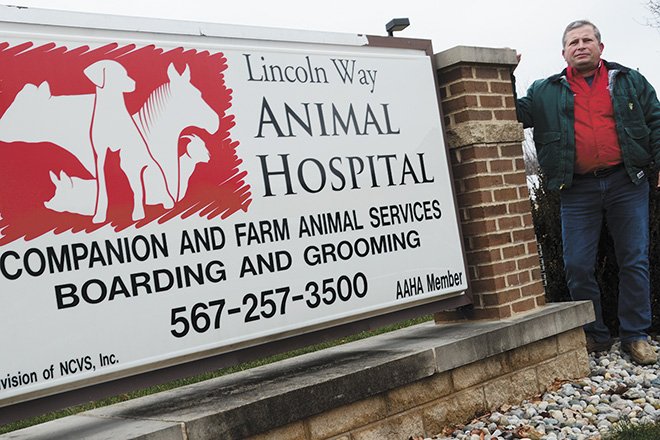
Where is `brown rectangular brick column`? The width and height of the screenshot is (660, 440). brown rectangular brick column is located at coordinates (478, 73).